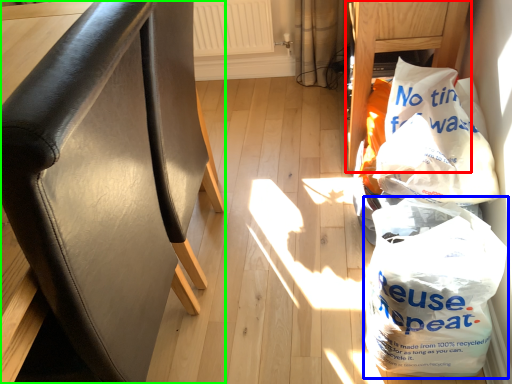
Question: Considering the real-world distances, which object is closest to furniture (highlighted by a red box)? plastic bag (highlighted by a blue box) or furniture (highlighted by a green box).

Choices:
 (A) plastic bag
 (B) furniture

Answer: (A)